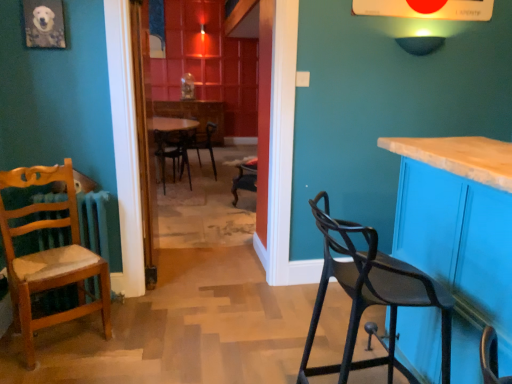
You are a GUI agent. You are given a task and a screenshot of the screen. Output one action in this format:
    pyautogui.click(x=<x>, y=<y>)
    Task: Click on the space that is in front of wooden chair with cushion at left, positioned as the second chair in front-to-back order
    The width and height of the screenshot is (512, 384).
    Given the screenshot: What is the action you would take?
    pyautogui.click(x=50, y=367)